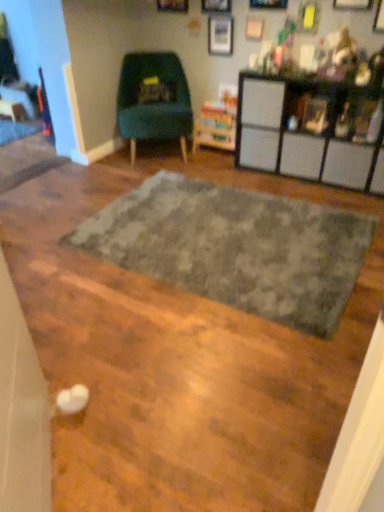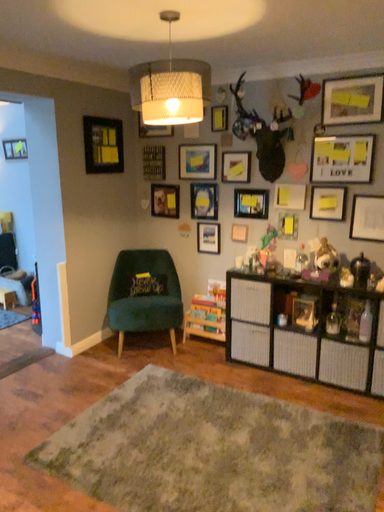
Question: How did the camera likely rotate when shooting the video?

Choices:
 (A) rotated upward
 (B) rotated downward

Answer: (A)